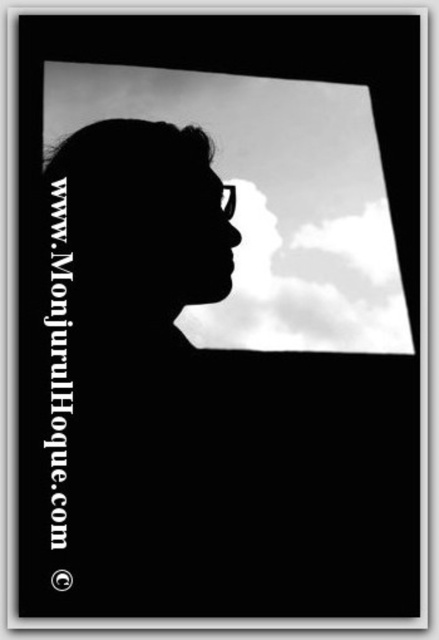
Which of these two, cloudy sky at upper center or white fluffy cloud at center, stands shorter?

white fluffy cloud at center

Between point (334, 136) and point (236, 211), which one is positioned behind?

The point (334, 136) is more distant.

In order to click on cloudy sky at upper center in this screenshot , I will do `click(272, 200)`.